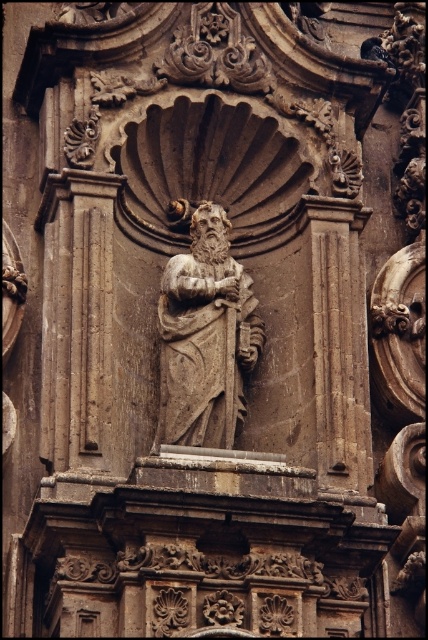
You are an architect analyzing the symmetry of the facade. The brown stone statue at center is marked by point (205, 337). Is this point the exact center of the entire facade?

The brown stone statue at center is represented by point (205, 337), so yes, this point is the exact center of the entire facade.